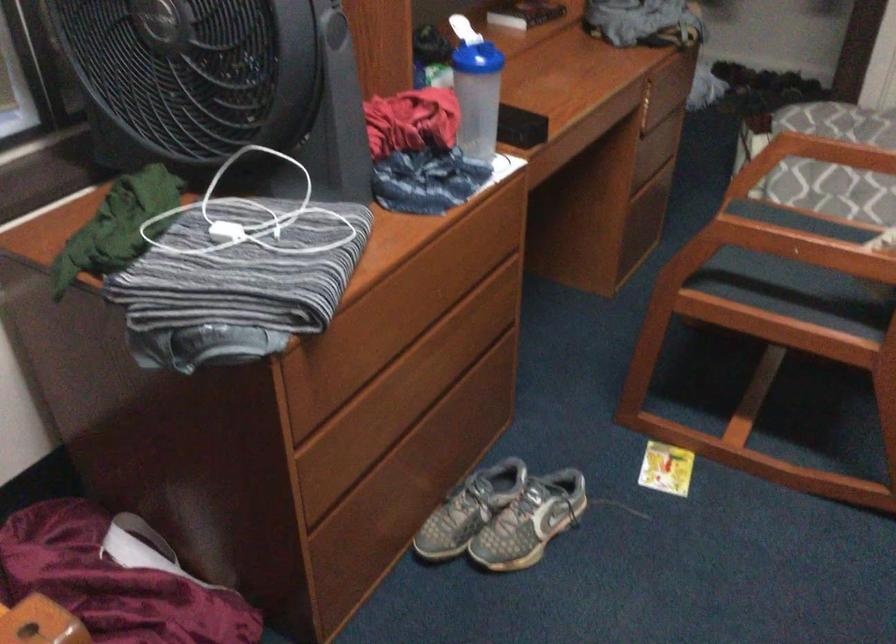
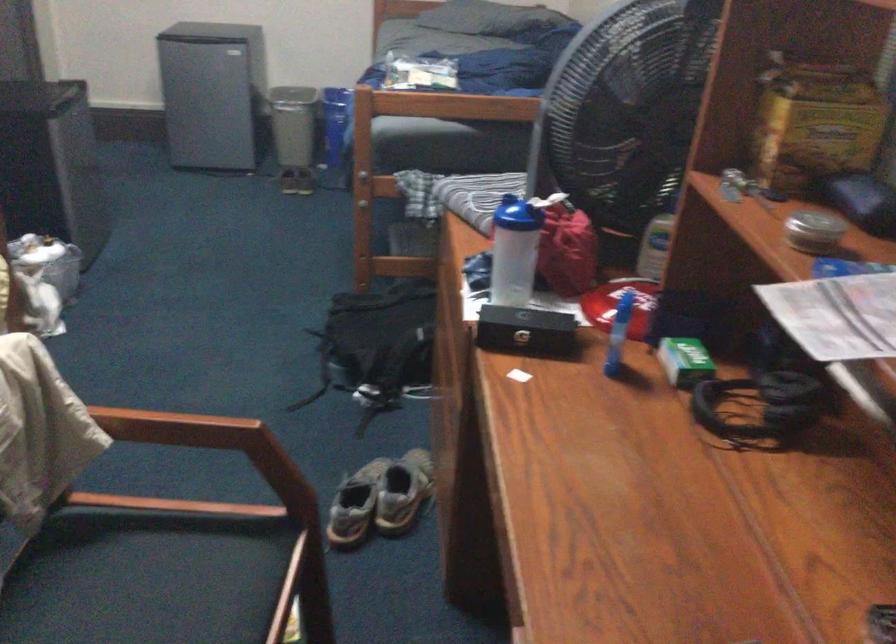
Where in the second image is the point corresponding to (x=479, y=89) from the first image?

(513, 251)